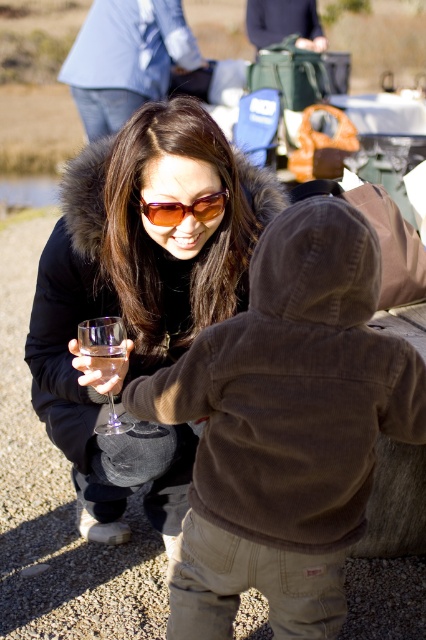
Is matte black jacket at center below sunglasses at center?

Indeed, matte black jacket at center is positioned under sunglasses at center.

Who is higher up, matte black jacket at center or sunglasses at center?

sunglasses at center

Between point (101, 228) and point (173, 208), which one is positioned behind?

The point (101, 228) is more distant.

The image size is (426, 640). Find the location of `matte black jacket at center`. matte black jacket at center is located at coordinates (140, 294).

Can you confirm if matte black jacket at center is wider than clear glass at lower center?

Indeed, matte black jacket at center has a greater width compared to clear glass at lower center.

Does matte black jacket at center appear over clear glass at lower center?

No.

Who is more distant from viewer, (210, 156) or (101, 355)?

The point (210, 156) is behind.

Identify the location of matte black jacket at center. (140, 294).

Is matte black jacket at center positioned at the back of clear glass wine glass at lower left?

Yes, it is behind clear glass wine glass at lower left.

Is matte black jacket at center in front of clear glass wine glass at lower left?

No, it is not.

What do you see at coordinates (140, 294) in the screenshot? This screenshot has height=640, width=426. I see `matte black jacket at center` at bounding box center [140, 294].

The height and width of the screenshot is (640, 426). Identify the location of matte black jacket at center. (140, 294).